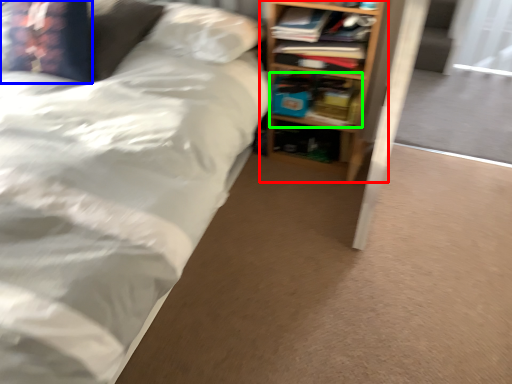
Question: Based on their relative distances, which object is nearer to shelf (highlighted by a red box)? Choose from pillow (highlighted by a blue box) and book (highlighted by a green box).

Choices:
 (A) pillow
 (B) book

Answer: (B)